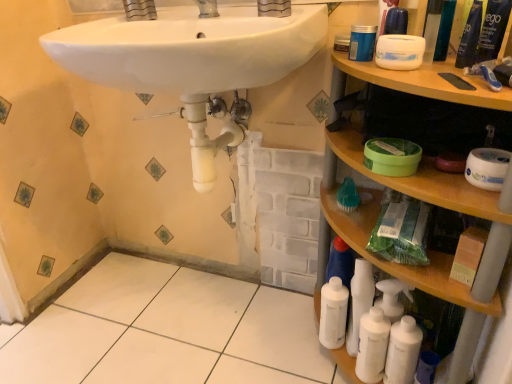
Question: Does white matte toilet paper at right, which appears as the 1th toilet paper when viewed from the right, turn towards matte silver faucet at upper center?

Choices:
 (A) no
 (B) yes

Answer: (A)

Question: Is white matte toilet paper at right, which appears as the 1th toilet paper when viewed from the right, turned away from matte silver faucet at upper center?

Choices:
 (A) no
 (B) yes

Answer: (A)

Question: Does white matte toilet paper at right, which appears as the 1th toilet paper when viewed from the right, appear on the right side of matte silver faucet at upper center?

Choices:
 (A) yes
 (B) no

Answer: (A)

Question: From a real-world perspective, is white matte toilet paper at right, marked as the 2th toilet paper in a left-to-right arrangement, beneath matte silver faucet at upper center?

Choices:
 (A) yes
 (B) no

Answer: (A)

Question: From a real-world perspective, is white matte toilet paper at right, marked as the 1th toilet paper in a bottom-to-top arrangement, physically above matte silver faucet at upper center?

Choices:
 (A) no
 (B) yes

Answer: (A)

Question: Is blue plastic mouthwash at upper right, which appears as the fourth mouthwash when ordered from the bottom, inside the boundaries of white matte toilet paper at right, marked as the 1th toilet paper in a bottom-to-top arrangement, or outside?

Choices:
 (A) inside
 (B) outside

Answer: (B)

Question: Based on their positions, is blue plastic mouthwash at upper right, which ranks as the third mouthwash in left-to-right order, located to the left or right of white matte toilet paper at right, marked as the 1th toilet paper in a bottom-to-top arrangement?

Choices:
 (A) right
 (B) left

Answer: (B)

Question: From a real-world perspective, is blue plastic mouthwash at upper right, which ranks as the third mouthwash in left-to-right order, above or below white matte toilet paper at right, marked as the 2th toilet paper in a left-to-right arrangement?

Choices:
 (A) above
 (B) below

Answer: (A)

Question: Considering the positions of blue plastic mouthwash at upper right, which appears as the fourth mouthwash when ordered from the bottom, and white matte toilet paper at right, the second toilet paper positioned from the top, in the image, is blue plastic mouthwash at upper right, which appears as the fourth mouthwash when ordered from the bottom, wider or thinner than white matte toilet paper at right, the second toilet paper positioned from the top,?

Choices:
 (A) wide
 (B) thin

Answer: (B)

Question: From a real-world perspective, is green plastic mouthwash at upper right, arranged as the first mouthwash when viewed from the top, above or below white tile floor at lower left?

Choices:
 (A) below
 (B) above

Answer: (B)

Question: In terms of height, does green plastic mouthwash at upper right, arranged as the first mouthwash when viewed from the top, look taller or shorter compared to white tile floor at lower left?

Choices:
 (A) tall
 (B) short

Answer: (A)

Question: Looking at the image, does green plastic mouthwash at upper right, which ranks as the fifth mouthwash in bottom-to-top order, seem bigger or smaller compared to white tile floor at lower left?

Choices:
 (A) small
 (B) big

Answer: (A)

Question: In terms of width, does green plastic mouthwash at upper right, which is counted as the 2th mouthwash, starting from the right, look wider or thinner when compared to white tile floor at lower left?

Choices:
 (A) wide
 (B) thin

Answer: (B)

Question: In terms of size, does blue plastic container at upper right, which appears as the 4th mouthwash when viewed from the top, appear bigger or smaller than white matte toothpaste at upper right?

Choices:
 (A) big
 (B) small

Answer: (A)

Question: Considering the positions of point (359, 44) and point (495, 84), is point (359, 44) closer or farther from the camera than point (495, 84)?

Choices:
 (A) farther
 (B) closer

Answer: (A)